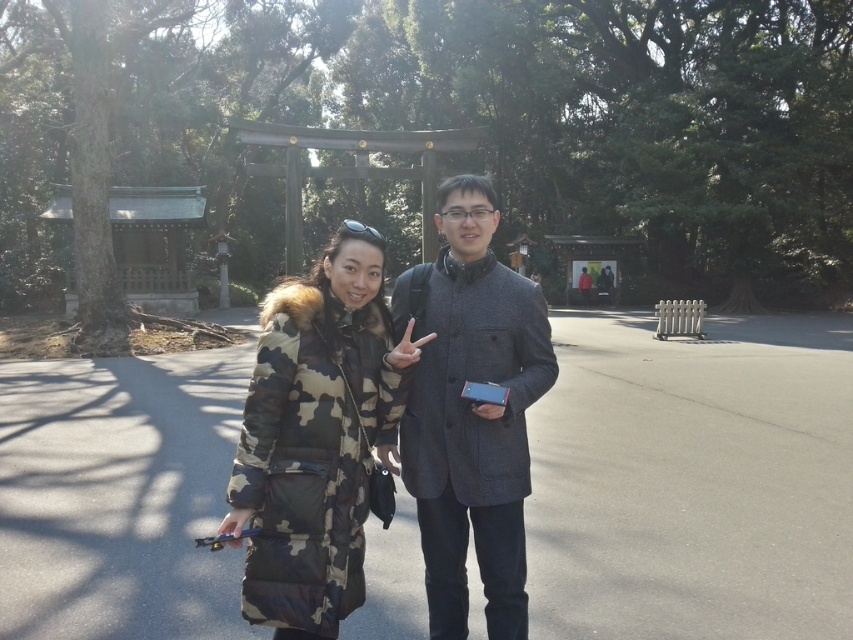
Question: Which object appears farthest from the camera in this image?

Choices:
 (A) camo fabric coat at center
 (B) gray wool coat at center

Answer: (B)

Question: Does camo fabric coat at center appear on the left side of gray wool coat at center?

Choices:
 (A) yes
 (B) no

Answer: (A)

Question: Which point is closer to the camera?

Choices:
 (A) camo fabric coat at center
 (B) gray wool coat at center

Answer: (A)

Question: Where is camo fabric coat at center located in relation to gray wool coat at center in the image?

Choices:
 (A) below
 (B) above

Answer: (A)

Question: Is camo fabric coat at center to the right of gray wool coat at center from the viewer's perspective?

Choices:
 (A) no
 (B) yes

Answer: (A)

Question: Among these objects, which one is farthest from the camera?

Choices:
 (A) gray wool coat at center
 (B) camo fabric coat at center

Answer: (A)